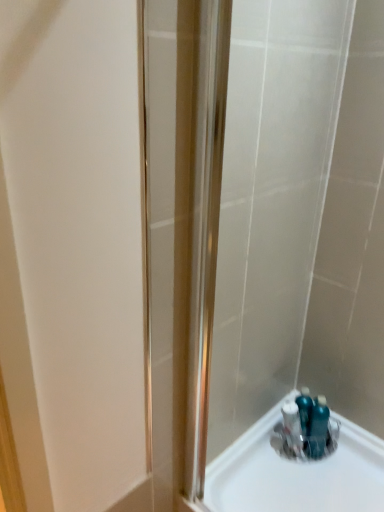
Where is `vacant space in front of blue glossy bottles at bottom right, which is the first sink from right to left`? This screenshot has width=384, height=512. vacant space in front of blue glossy bottles at bottom right, which is the first sink from right to left is located at coordinates (331, 481).